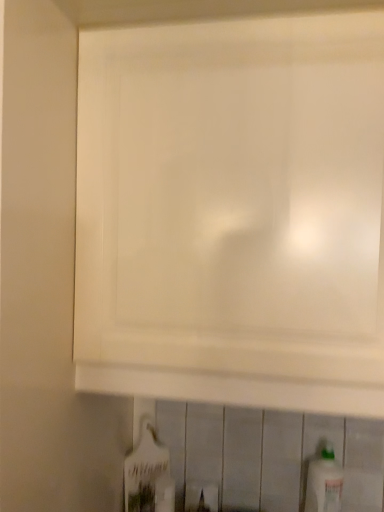
Question: Does white matte cabinet at upper center have a lesser height compared to white glossy bottle at lower center, which is the 2th bottle in right-to-left order?

Choices:
 (A) no
 (B) yes

Answer: (A)

Question: Can you confirm if white matte cabinet at upper center is taller than white glossy bottle at lower center, which ranks as the 1th bottle in left-to-right order?

Choices:
 (A) yes
 (B) no

Answer: (A)

Question: Can white glossy bottle at lower center, which ranks as the 1th bottle in left-to-right order, be found inside white matte cabinet at upper center?

Choices:
 (A) no
 (B) yes

Answer: (A)

Question: Is white matte cabinet at upper center closer to camera compared to white glossy bottle at lower center, which is the 2th bottle in right-to-left order?

Choices:
 (A) no
 (B) yes

Answer: (B)

Question: Are white matte cabinet at upper center and white glossy bottle at lower center, which ranks as the 1th bottle in left-to-right order, far apart?

Choices:
 (A) yes
 (B) no

Answer: (B)

Question: Is point (142, 437) closer or farther from the camera than point (319, 481)?

Choices:
 (A) farther
 (B) closer

Answer: (A)

Question: Based on their sizes in the image, would you say white glossy bottle at lower center, which is the 2th bottle in right-to-left order, is bigger or smaller than white plastic bottle at lower right, which is the 2th bottle from left to right?

Choices:
 (A) small
 (B) big

Answer: (A)

Question: From the image's perspective, relative to white plastic bottle at lower right, which is the 2th bottle from left to right, is white glossy bottle at lower center, which is the 2th bottle in right-to-left order, above or below?

Choices:
 (A) below
 (B) above

Answer: (B)

Question: Visually, is white glossy bottle at lower center, which ranks as the 1th bottle in left-to-right order, positioned to the left or to the right of white plastic bottle at lower right, the first bottle positioned from the right?

Choices:
 (A) left
 (B) right

Answer: (A)

Question: In terms of size, does white matte cabinet at upper center appear bigger or smaller than white glossy bottle at lower center, which is the 2th bottle in right-to-left order?

Choices:
 (A) big
 (B) small

Answer: (A)

Question: Visually, is white matte cabinet at upper center positioned to the left or to the right of white glossy bottle at lower center, which is the 2th bottle in right-to-left order?

Choices:
 (A) right
 (B) left

Answer: (A)

Question: Considering the positions of white matte cabinet at upper center and white glossy bottle at lower center, which ranks as the 1th bottle in left-to-right order, in the image, is white matte cabinet at upper center wider or thinner than white glossy bottle at lower center, which ranks as the 1th bottle in left-to-right order,?

Choices:
 (A) thin
 (B) wide

Answer: (B)

Question: Considering the positions of white matte cabinet at upper center and white glossy bottle at lower center, which is the 2th bottle in right-to-left order, in the image, is white matte cabinet at upper center taller or shorter than white glossy bottle at lower center, which is the 2th bottle in right-to-left order,?

Choices:
 (A) tall
 (B) short

Answer: (A)

Question: Visually, is white plastic bottle at lower right, which is the 2th bottle from left to right, positioned to the left or to the right of white glossy bottle at lower center, which is the 2th bottle in right-to-left order?

Choices:
 (A) right
 (B) left

Answer: (A)

Question: In the image, is white plastic bottle at lower right, the first bottle positioned from the right, positioned in front of or behind white glossy bottle at lower center, which ranks as the 1th bottle in left-to-right order?

Choices:
 (A) front
 (B) behind

Answer: (A)